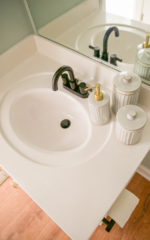
You are a GUI agent. You are given a task and a screenshot of the screen. Output one action in this format:
    pyautogui.click(x=<x>, y=<y>)
    Task: Click on the soap dispenser
    This screenshot has width=150, height=240.
    Given the screenshot: What is the action you would take?
    pyautogui.click(x=97, y=107)